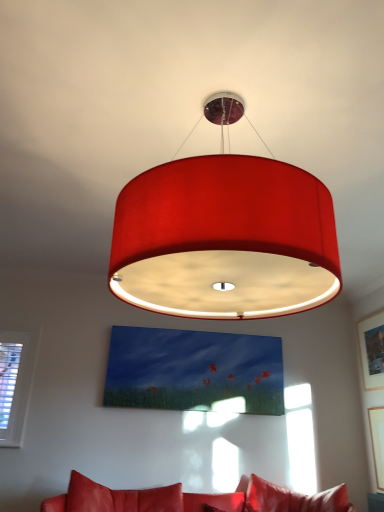
Question: Does matte fabric lampshade at center have a lesser width compared to wooden picture frame at upper right, the first picture frame positioned from the top?

Choices:
 (A) no
 (B) yes

Answer: (A)

Question: Would you say wooden picture frame at upper right, which is the second picture frame from bottom to top, is part of matte fabric lampshade at center's contents?

Choices:
 (A) yes
 (B) no

Answer: (B)

Question: From the image's perspective, is matte fabric lampshade at center above wooden picture frame at upper right, the first picture frame positioned from the top?

Choices:
 (A) yes
 (B) no

Answer: (A)

Question: From a real-world perspective, is matte fabric lampshade at center under wooden picture frame at upper right, which is the second picture frame from bottom to top?

Choices:
 (A) yes
 (B) no

Answer: (B)

Question: From the image's perspective, is matte fabric lampshade at center beneath wooden picture frame at upper right, the first picture frame positioned from the top?

Choices:
 (A) yes
 (B) no

Answer: (B)

Question: Can you confirm if matte fabric lampshade at center is positioned to the right of wooden picture frame at upper right, which is the second picture frame from bottom to top?

Choices:
 (A) yes
 (B) no

Answer: (B)

Question: Does matte white picture frame at upper right, which is the 1th picture frame in bottom-to-top order, appear on the right side of matte fabric lampshade at center?

Choices:
 (A) no
 (B) yes

Answer: (B)

Question: Is matte white picture frame at upper right, which is the 2th picture frame in top-to-bottom order, positioned before matte fabric lampshade at center?

Choices:
 (A) no
 (B) yes

Answer: (A)

Question: Is matte fabric lampshade at center a part of matte white picture frame at upper right, which is the 2th picture frame in top-to-bottom order?

Choices:
 (A) no
 (B) yes

Answer: (A)

Question: Is matte white picture frame at upper right, which is the 1th picture frame in bottom-to-top order, next to matte fabric lampshade at center?

Choices:
 (A) yes
 (B) no

Answer: (B)

Question: Considering the relative sizes of matte white picture frame at upper right, which is the 1th picture frame in bottom-to-top order, and matte fabric lampshade at center in the image provided, is matte white picture frame at upper right, which is the 1th picture frame in bottom-to-top order, taller than matte fabric lampshade at center?

Choices:
 (A) yes
 (B) no

Answer: (B)

Question: Considering the relative sizes of matte white picture frame at upper right, which is the 2th picture frame in top-to-bottom order, and matte fabric lampshade at center in the image provided, is matte white picture frame at upper right, which is the 2th picture frame in top-to-bottom order, wider than matte fabric lampshade at center?

Choices:
 (A) yes
 (B) no

Answer: (B)

Question: Is matte fabric lampshade at center facing away from leather couch at lower center?

Choices:
 (A) yes
 (B) no

Answer: (B)